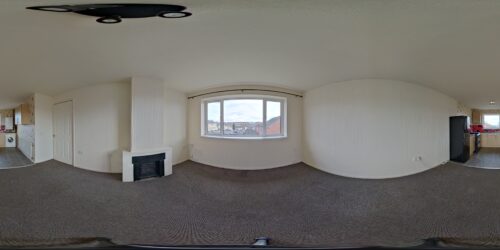
You are a GUI agent. You are given a task and a screenshot of the screen. Output one action in this format:
    pyautogui.click(x=<x>, y=<y>)
    Task: Click on the door to left of center
    
    Given the screenshot: What is the action you would take?
    pyautogui.click(x=66, y=129)